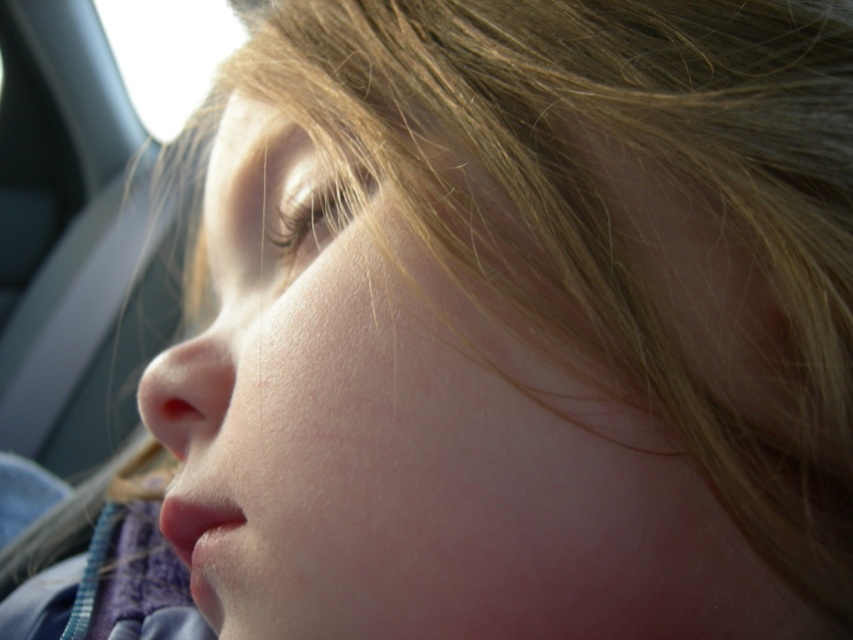
You are a photographer trying to capture the reflection of the transparent glass car window at upper left and the smooth skin nose at center in a photo. Which object is wider in the image?

The transparent glass car window at upper left might be wider than smooth skin nose at center, so it is possibly wider.

You are a passenger in a car and want to check the weather outside through the transparent glass car window at upper left while keeping your smooth skin nose at center inside. Can you do this without moving your head?

The transparent glass car window at upper left is to the left of the smooth skin nose at center, so yes, you can check the weather outside through the transparent glass car window at upper left without moving your head since it is positioned to the left of your nose.

You are a photographer adjusting the focus on a camera. You have two points to focus on in the image, point [142,67] and point [216,349]. Which point should you focus on to capture the part of the face that is closer to the camera?

Point [142,67] is further to the camera than point [216,349], so you should focus on point [142,67] to capture the part of the face that is closer to the camera.